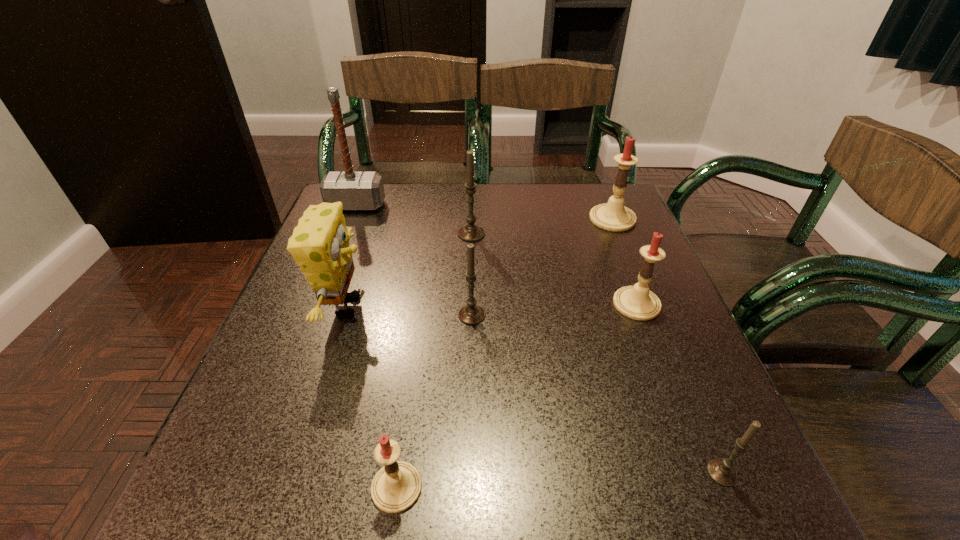
The height and width of the screenshot is (540, 960). In the image, there is a desktop. In order to click on vacant region at the far right corner in this screenshot , I will do `click(575, 211)`.

Where is `empty space that is in between the sponge and the biggest gray candle`? empty space that is in between the sponge and the biggest gray candle is located at coordinates (409, 270).

The image size is (960, 540). I want to click on vacant space that is in between the second biggest gray candle and the hammer, so click(414, 260).

What are the coordinates of `unoccupied position between the second nearest red candle and the smallest gray candle` in the screenshot? It's located at (679, 388).

Locate an element on the screen. The image size is (960, 540). free space between the rightmost gray candle and the biggest gray candle is located at coordinates (596, 353).

The height and width of the screenshot is (540, 960). Identify the location of unoccupied position between the second nearest red candle and the smallest gray candle. (679, 388).

Identify the location of vacant space in between the biggest gray candle and the nearest gray candle. (596, 353).

At what (x,y) coordinates should I click in order to perform the action: click on free spot between the smallest red candle and the farthest red candle. Please return your answer as a coordinate pair (x, y). Looking at the image, I should click on (505, 353).

At what (x,y) coordinates should I click in order to perform the action: click on free space between the second nearest red candle and the rightmost gray candle. Please return your answer as a coordinate pair (x, y). Looking at the image, I should click on (679, 388).

This screenshot has width=960, height=540. Find the location of `vacant space that's between the second nearest red candle and the biggest gray candle`. vacant space that's between the second nearest red candle and the biggest gray candle is located at coordinates [x=554, y=269].